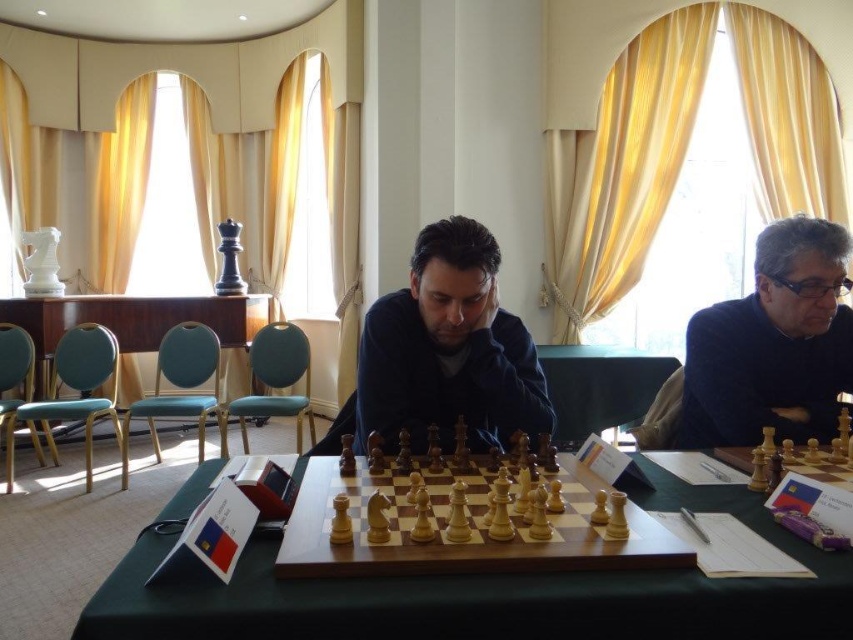
Question: Is wooden chessboard at center above wooden at center?

Choices:
 (A) yes
 (B) no

Answer: (B)

Question: Which of these objects is positioned farthest from the dark blue sweater at center?

Choices:
 (A) wooden at center
 (B) green felt table at center

Answer: (A)

Question: Does green felt table at center have a larger size compared to dark blue sweater at right?

Choices:
 (A) yes
 (B) no

Answer: (B)

Question: Which point appears closest to the camera in this image?

Choices:
 (A) (811, 248)
 (B) (479, 513)

Answer: (B)

Question: Does dark blue sweater at right have a greater width compared to wooden at center?

Choices:
 (A) no
 (B) yes

Answer: (A)

Question: Which of the following is the farthest from the observer?

Choices:
 (A) dark blue sweater at right
 (B) dark blue sweater at center
 (C) wooden at center
 (D) wooden chessboard at center

Answer: (C)